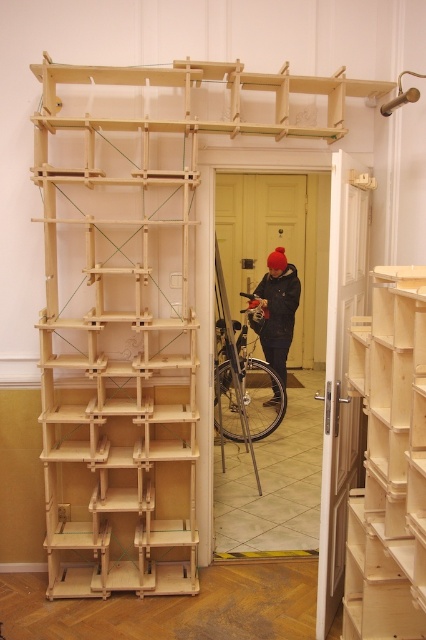
Question: Estimate the real-world distances between objects in this image. Which object is farther from the dark blue jacket at center?

Choices:
 (A) black matte jacket at center
 (B) black rubber tire at center
 (C) pine wood shelves at right
 (D) natural wood shelf at left

Answer: (C)

Question: Does natural wood shelf at left have a lesser width compared to dark blue jacket at center?

Choices:
 (A) no
 (B) yes

Answer: (A)

Question: Which of the following is the closest to the observer?

Choices:
 (A) coord(368,624)
 (B) coord(279,388)

Answer: (A)

Question: Is pine wood shelves at right bigger than dark blue jacket at center?

Choices:
 (A) no
 (B) yes

Answer: (A)

Question: Can you confirm if natural wood shelf at left is positioned below pine wood shelves at right?

Choices:
 (A) yes
 (B) no

Answer: (B)

Question: Among these objects, which one is nearest to the camera?

Choices:
 (A) natural wood shelf at left
 (B) pine wood shelves at right

Answer: (B)